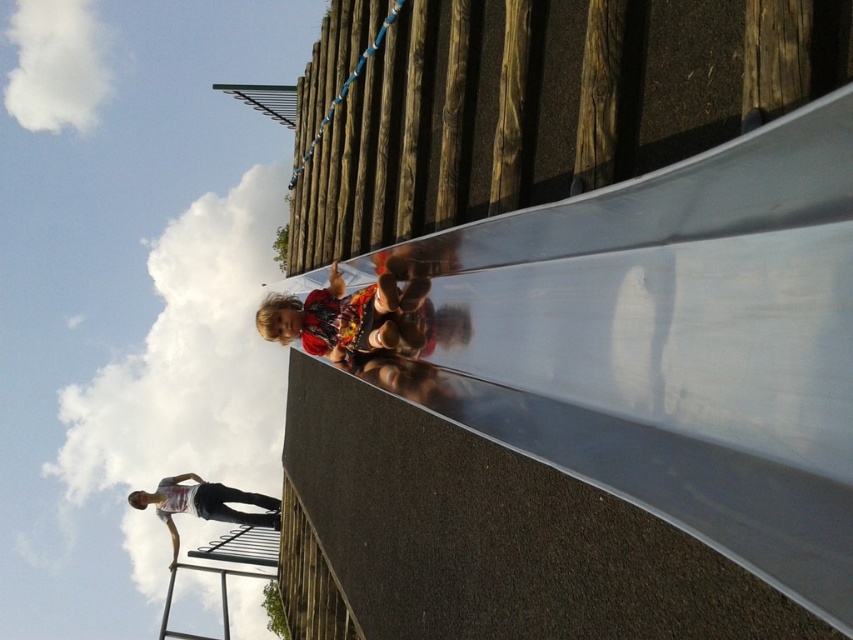
Does matte red shirt at center have a lesser width compared to white cotton tank top at upper left?

Correct, matte red shirt at center's width is less than white cotton tank top at upper left's.

This screenshot has width=853, height=640. What do you see at coordinates (349, 317) in the screenshot?
I see `matte red shirt at center` at bounding box center [349, 317].

Find the location of a particular element. This screenshot has height=640, width=853. matte red shirt at center is located at coordinates (349, 317).

The width and height of the screenshot is (853, 640). Identify the location of matte red shirt at center. (349, 317).

Is white cotton tank top at upper left bigger than metallic silver ladder at lower left?

Indeed, white cotton tank top at upper left has a larger size compared to metallic silver ladder at lower left.

Who is shorter, white cotton tank top at upper left or metallic silver ladder at lower left?

metallic silver ladder at lower left

The width and height of the screenshot is (853, 640). Find the location of `white cotton tank top at upper left`. white cotton tank top at upper left is located at coordinates (204, 504).

Between matte red shirt at center and metallic silver ladder at lower left, which one appears on the left side from the viewer's perspective?

From the viewer's perspective, metallic silver ladder at lower left appears more on the left side.

Which of these two, matte red shirt at center or metallic silver ladder at lower left, stands taller?

matte red shirt at center is taller.

Identify the location of matte red shirt at center. (349, 317).